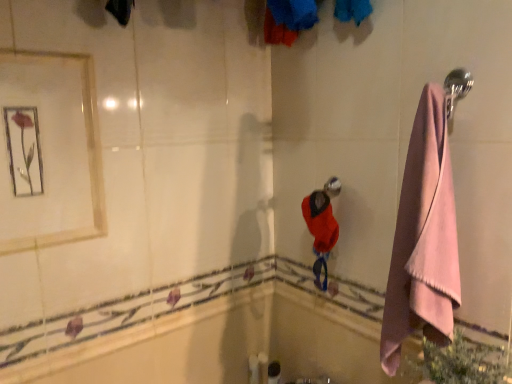
Question: Does metallic framed mirror at upper left have a larger size compared to satin silver shower head at center?

Choices:
 (A) no
 (B) yes

Answer: (B)

Question: Considering the relative sizes of metallic framed mirror at upper left and satin silver shower head at center in the image provided, is metallic framed mirror at upper left thinner than satin silver shower head at center?

Choices:
 (A) yes
 (B) no

Answer: (A)

Question: Are metallic framed mirror at upper left and satin silver shower head at center making contact?

Choices:
 (A) no
 (B) yes

Answer: (A)

Question: Does metallic framed mirror at upper left appear on the right side of satin silver shower head at center?

Choices:
 (A) no
 (B) yes

Answer: (A)

Question: Does metallic framed mirror at upper left have a lesser height compared to satin silver shower head at center?

Choices:
 (A) no
 (B) yes

Answer: (A)

Question: Could you tell me if metallic framed mirror at upper left is facing satin silver shower head at center?

Choices:
 (A) yes
 (B) no

Answer: (B)

Question: Is satin silver shower head at center outside of white glossy bath at lower left?

Choices:
 (A) yes
 (B) no

Answer: (A)

Question: Is satin silver shower head at center turned away from white glossy bath at lower left?

Choices:
 (A) yes
 (B) no

Answer: (B)

Question: Considering the relative sizes of satin silver shower head at center and white glossy bath at lower left in the image provided, is satin silver shower head at center thinner than white glossy bath at lower left?

Choices:
 (A) yes
 (B) no

Answer: (B)

Question: Is satin silver shower head at center at the left side of white glossy bath at lower left?

Choices:
 (A) yes
 (B) no

Answer: (B)

Question: Is satin silver shower head at center closer to camera compared to white glossy bath at lower left?

Choices:
 (A) yes
 (B) no

Answer: (B)

Question: Can you see satin silver shower head at center touching white glossy bath at lower left?

Choices:
 (A) yes
 (B) no

Answer: (B)

Question: From the image's perspective, does metallic framed mirror at upper left appear lower than white glossy bath at lower left?

Choices:
 (A) no
 (B) yes

Answer: (A)